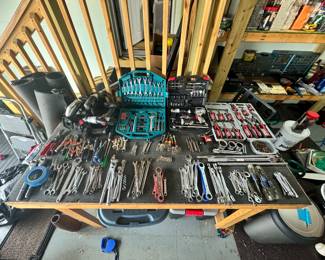
Locate an element on the screen. This screenshot has width=325, height=260. stepping stool is located at coordinates (15, 127).